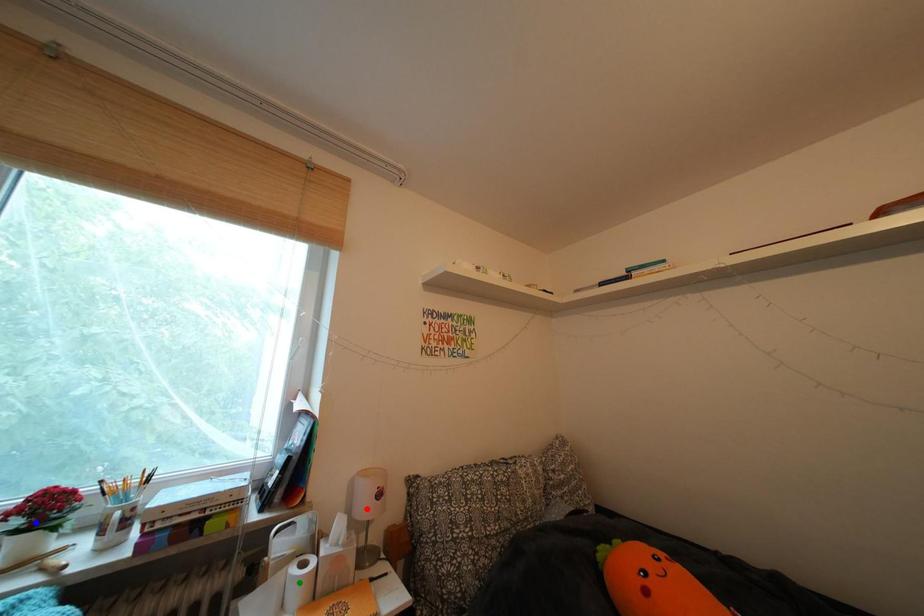
Order these from nearest to farthest:
green point | red point | blue point

red point
green point
blue point